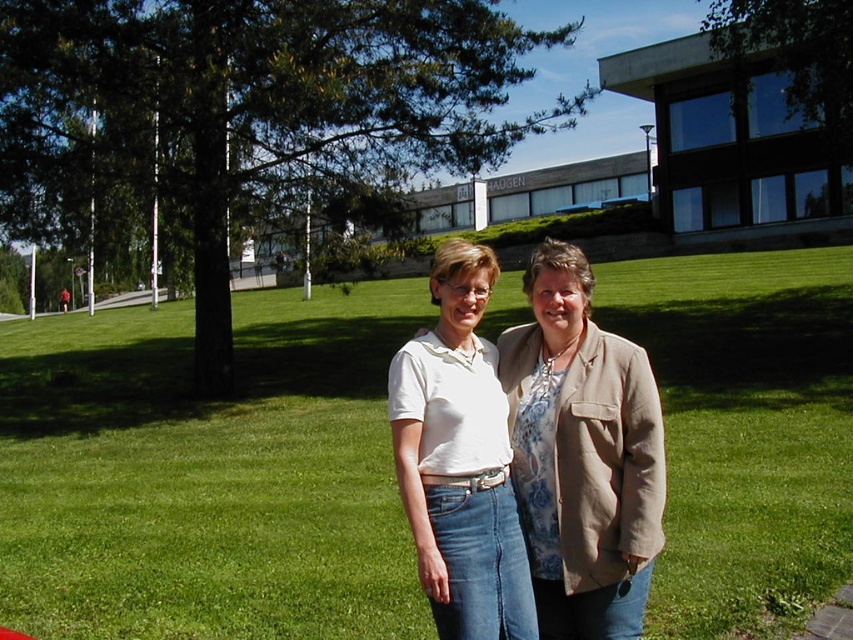
Question: Which object is farther from the camera taking this photo?

Choices:
 (A) white cotton shirt at center
 (B) green grass at center

Answer: (B)

Question: Which of the following is the farthest from the observer?

Choices:
 (A) (619, 458)
 (B) (242, 317)

Answer: (B)

Question: Is the position of green grass at center more distant than that of white cotton shirt at center?

Choices:
 (A) no
 (B) yes

Answer: (B)

Question: Considering the relative positions of green grass at center and white cotton shirt at center in the image provided, where is green grass at center located with respect to white cotton shirt at center?

Choices:
 (A) above
 (B) below

Answer: (A)

Question: Is green grass at center further to the viewer compared to white cotton shirt at center?

Choices:
 (A) no
 (B) yes

Answer: (B)

Question: Which of the following is the closest to the observer?

Choices:
 (A) green grass at center
 (B) white cotton shirt at center

Answer: (B)